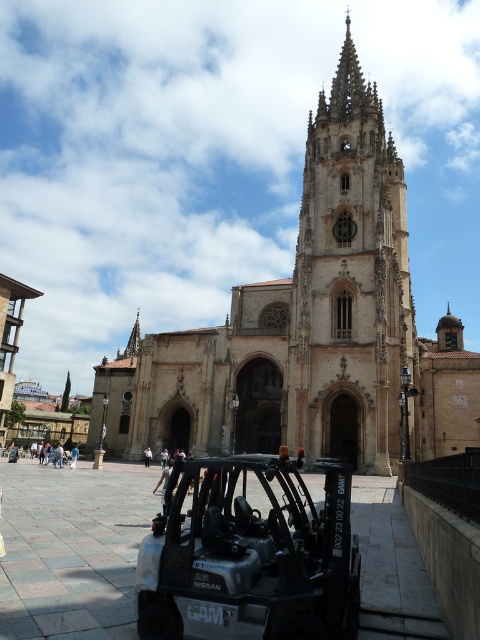
Question: Does golden stone tower at center appear under black matte forklift at lower center?

Choices:
 (A) no
 (B) yes

Answer: (A)

Question: Considering the real-world distances, which object is closest to the black matte forklift at lower center?

Choices:
 (A) beige stone church at center
 (B) golden stone tower at center

Answer: (A)

Question: Which of these objects is positioned farthest from the black matte forklift at lower center?

Choices:
 (A) golden stone tower at center
 (B) beige stone church at center

Answer: (A)

Question: Which point is farther to the camera?

Choices:
 (A) (381, 385)
 (B) (240, 332)
 (C) (216, 472)

Answer: (B)

Question: Is golden stone tower at center below black matte forklift at lower center?

Choices:
 (A) yes
 (B) no

Answer: (B)

Question: Is beige stone church at center further to the viewer compared to golden stone tower at center?

Choices:
 (A) yes
 (B) no

Answer: (B)